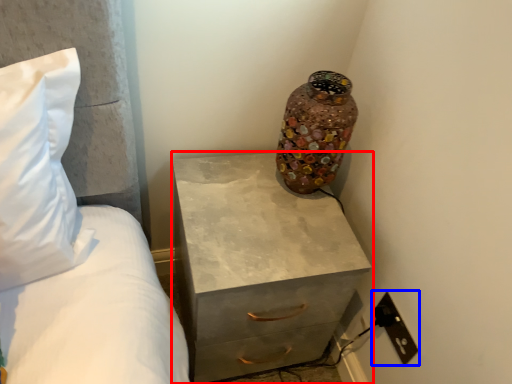
Question: Which of the following is the farthest to the observer, chest of drawers (highlighted by a red box) or electric outlet (highlighted by a blue box)?

Choices:
 (A) chest of drawers
 (B) electric outlet

Answer: (B)